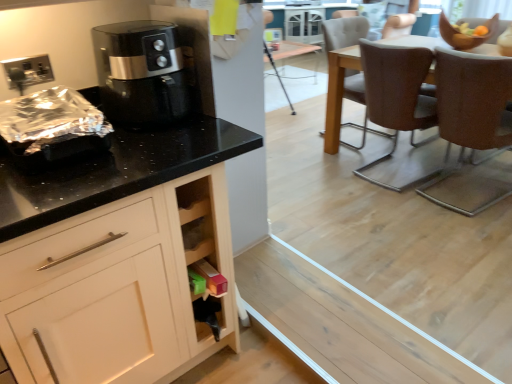
Locate an element on the screen. Image resolution: width=512 pixels, height=384 pixels. vacant space in brown leather chair at center, which is counted as the 2th chair, starting from the front (from a real-world perspective) is located at coordinates (398, 168).